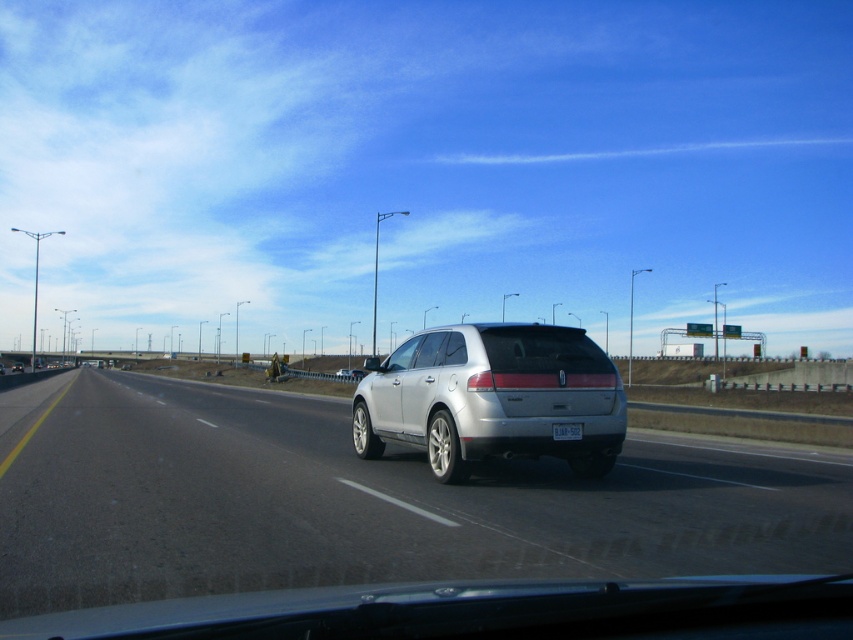
Question: Which object is the closest to the clear glass windshield at center?

Choices:
 (A) silver metallic suv at center
 (B) white plastic license plate at center

Answer: (B)

Question: Which point appears farthest from the camera in this image?

Choices:
 (A) (577, 422)
 (B) (450, 356)
 (C) (105, 596)
 (D) (579, 365)

Answer: (B)

Question: Observing the image, what is the correct spatial positioning of silver metallic suv at center in reference to satin silver suv at center?

Choices:
 (A) above
 (B) below

Answer: (B)

Question: Which object is farther from the camera taking this photo?

Choices:
 (A) silver metallic suv at center
 (B) white plastic license plate at center
 (C) clear glass windshield at center

Answer: (C)

Question: Does satin silver suv at center appear on the right side of clear glass windshield at center?

Choices:
 (A) no
 (B) yes

Answer: (A)

Question: Does silver metallic suv at center have a greater width compared to clear glass windshield at center?

Choices:
 (A) yes
 (B) no

Answer: (A)